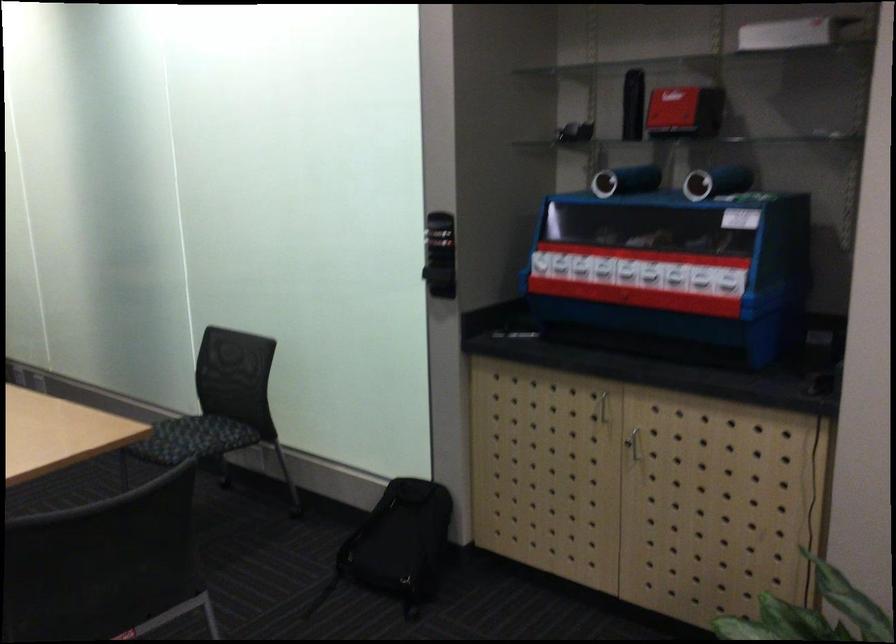
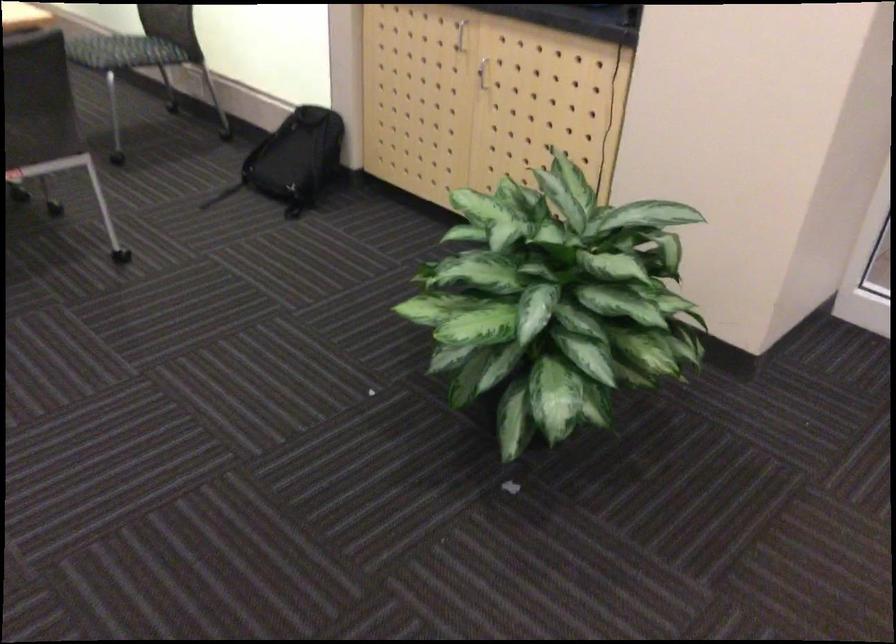
Question: The images are taken continuously from a first-person perspective. In which direction is your viewpoint rotating?

Choices:
 (A) Left
 (B) Right
 (C) Up
 (D) Down

Answer: (D)